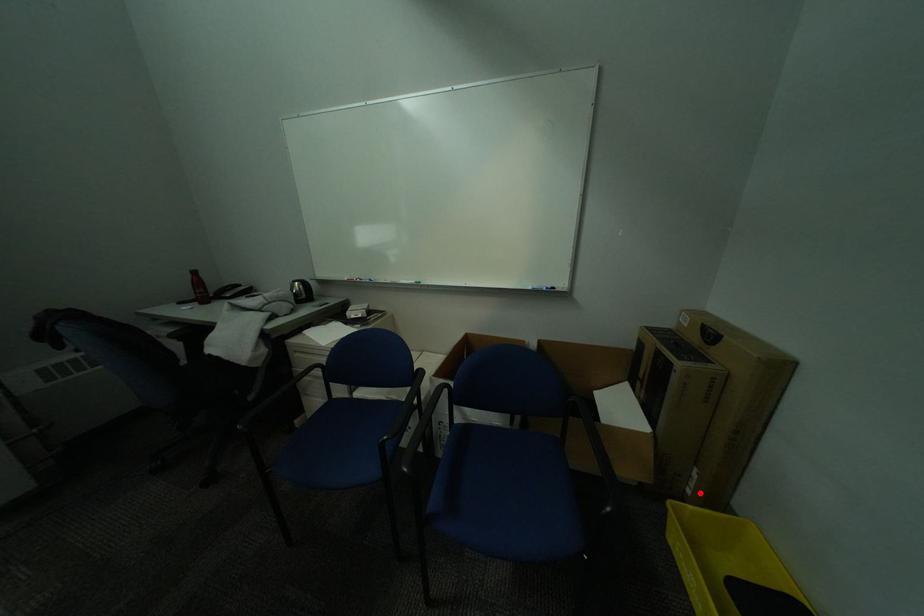
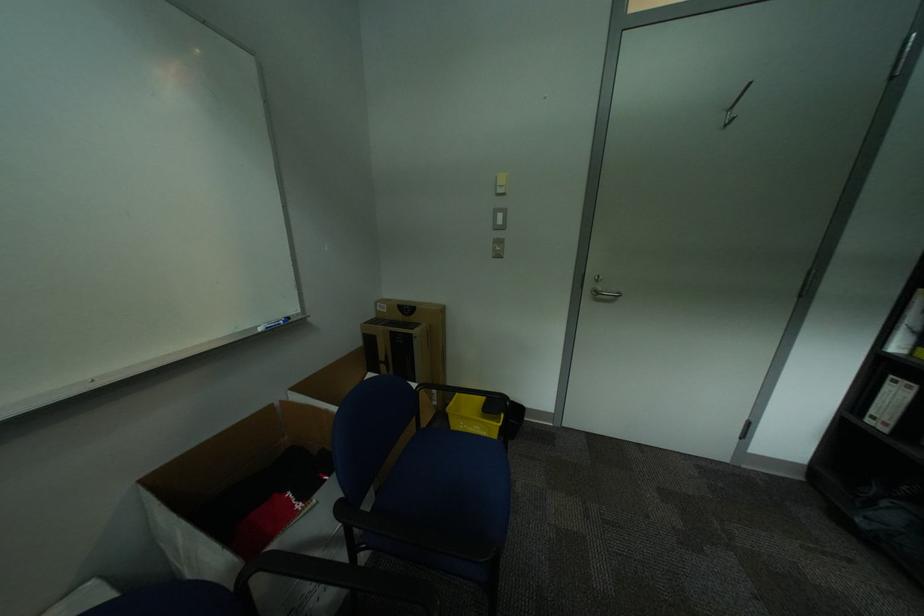
Question: I am providing you with two images of the same scene from different viewpoints. In image1, a red point is highlighted. Considering the same 3D point in image2, which of the following is correct?

Choices:
 (A) It is closer
 (B) It is farther

Answer: (B)